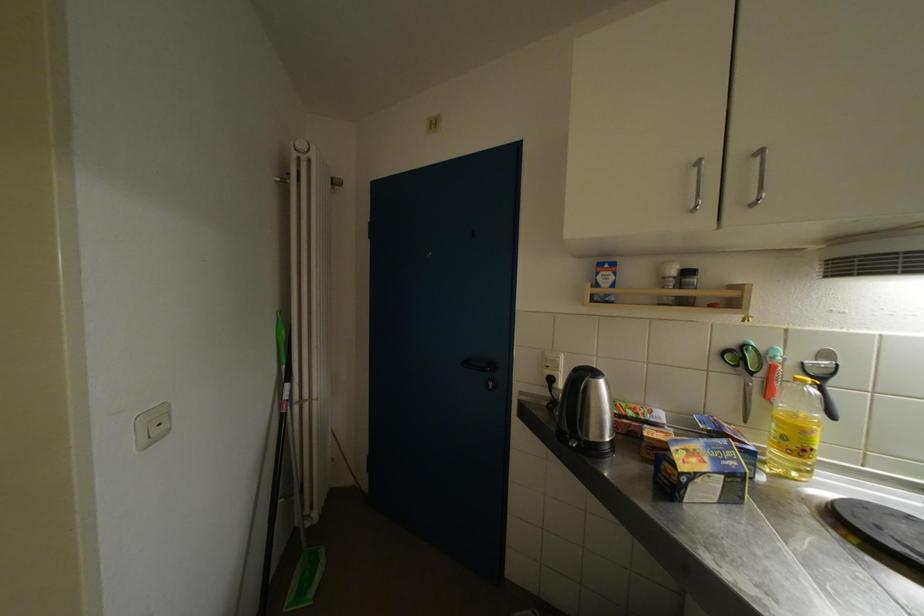
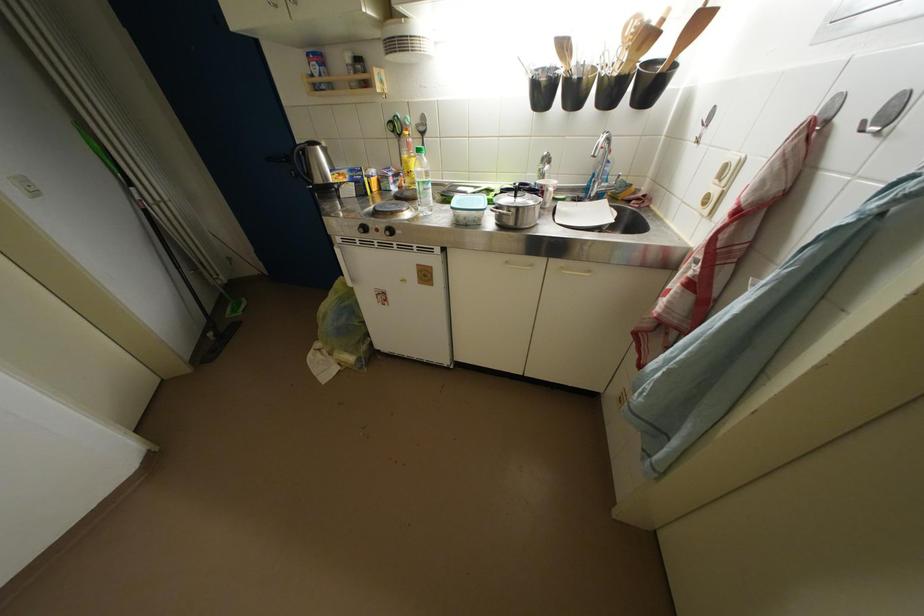
In the second image, find the point that corresponds to the point at 758,378 in the first image.

(407, 140)